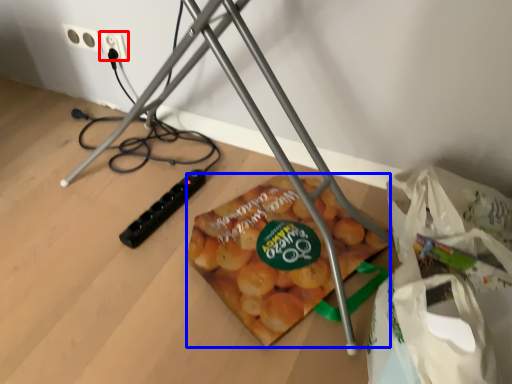
Question: Among these objects, which one is nearest to the camera, power plugs and sockets (highlighted by a red box) or snack (highlighted by a blue box)?

Choices:
 (A) power plugs and sockets
 (B) snack

Answer: (B)